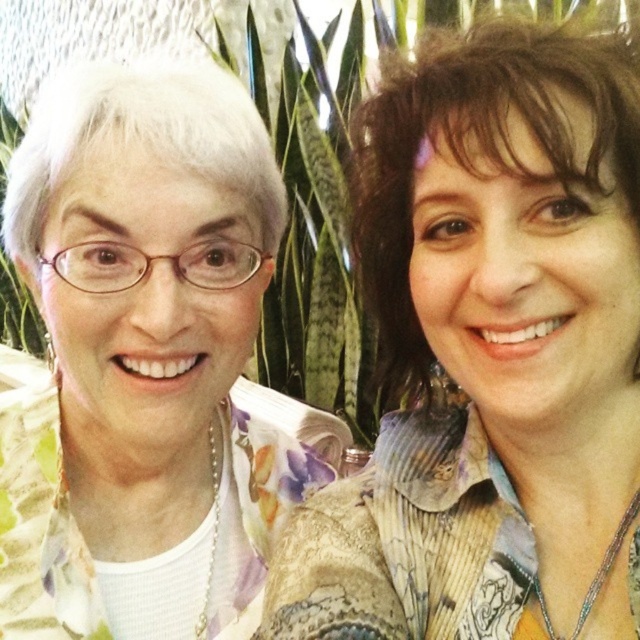
You are a photographer adjusting the lighting for a portrait. You need to place a reflector at point (490, 355) to highlight the floral fabric blouse at left. Is the point where you want to place the reflector located on the left or right side of the image?

The point (490, 355) is on the left side of the image, so placing the reflector there will effectively highlight the floral fabric blouse at left.

You are a photographer arranging two people for a photo shoot. The subjects are wearing a floral fabric blouse at left and a white floral shirt at left. Based on the scene description, which clothing item is positioned more to the left?

The white floral shirt at left is positioned more to the left since the floral fabric blouse at left is to the right of it.

In the scene shown: You are a photographer trying to capture a group photo of the two people in the scene. You want to ensure there is enough space between them for a small decorative item that is 8 inches wide. Based on their current positions, will the space between the floral fabric blouse at left and the white floral shirt at left be sufficient to place the item?

The space between the floral fabric blouse at left and the white floral shirt at left is only 7.56 inches, which is narrower than the 8 inches required for the decorative item. Therefore, the item will not fit between them.